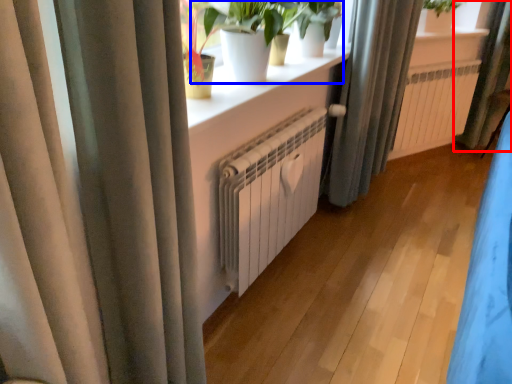
Question: Which object appears farthest to the camera in this image, curtain (highlighted by a red box) or houseplant (highlighted by a blue box)?

Choices:
 (A) curtain
 (B) houseplant

Answer: (A)